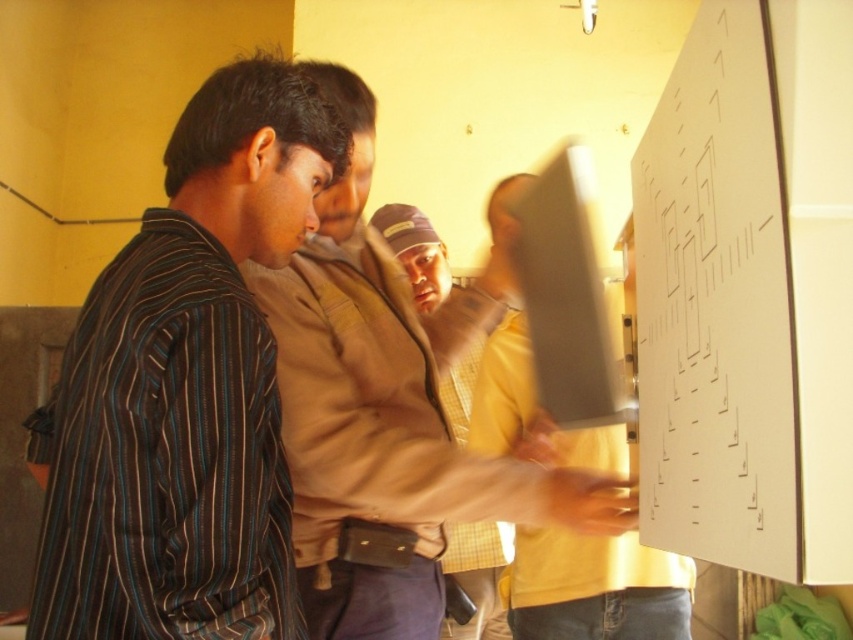
Is striped fabric shirt at center positioned in front of brown leather jacket at center?

Yes, it is in front of brown leather jacket at center.

Who is taller, striped fabric shirt at center or brown leather jacket at center?

With more height is striped fabric shirt at center.

Does point (486, 484) come behind point (461, 378)?

No, (486, 484) is closer to viewer.

What are the coordinates of `striped fabric shirt at center` in the screenshot? It's located at (392, 416).

Image resolution: width=853 pixels, height=640 pixels. What do you see at coordinates (184, 387) in the screenshot?
I see `striped fabric shirt at left` at bounding box center [184, 387].

Is point (200, 618) positioned after point (329, 426)?

No, it is not.

Find the location of `striped fabric shirt at left`. striped fabric shirt at left is located at coordinates (184, 387).

Which is in front, point (448, 481) or point (715, 445)?

Point (715, 445)

Is point (578, 525) in front of point (764, 157)?

No, (578, 525) is further to viewer.

You are a GUI agent. You are given a task and a screenshot of the screen. Output one action in this format:
    pyautogui.click(x=<x>, y=<y>)
    Task: Click on the striped fabric shirt at center
    
    Given the screenshot: What is the action you would take?
    pyautogui.click(x=392, y=416)